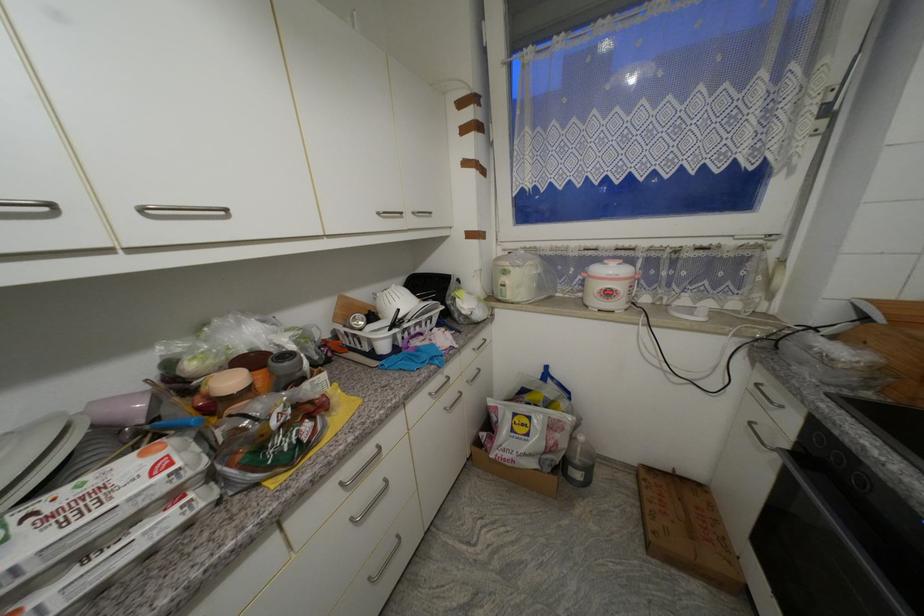
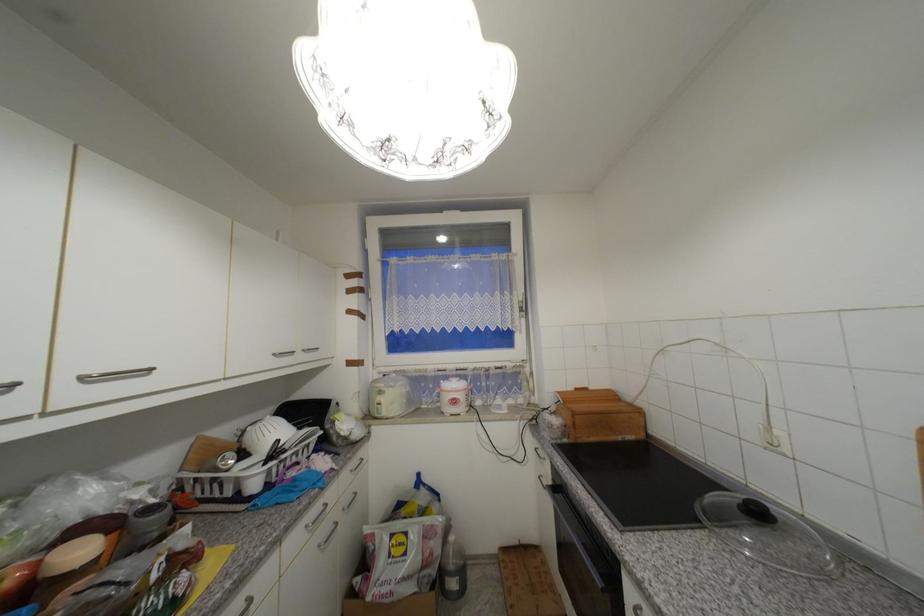
In the second image, find the point that corresponds to [614,294] in the first image.

(459, 403)